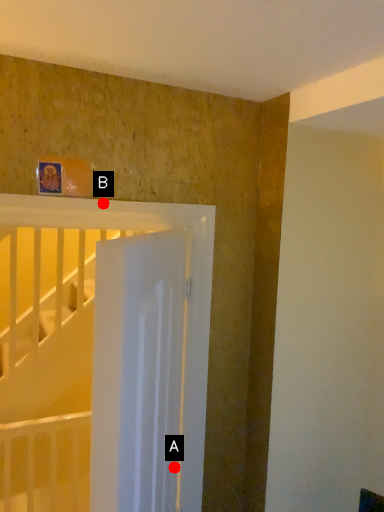
Question: Two points are circled on the image, labeled by A and B beside each circle. Which of the following is the farthest from the observer?

Choices:
 (A) A is further
 (B) B is further

Answer: (A)